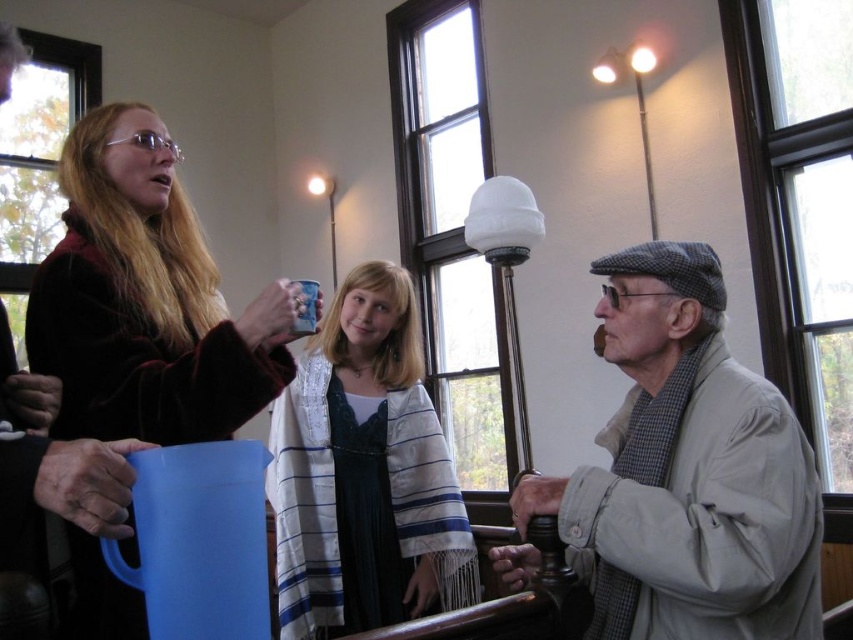
Question: Which point is farther to the camera?

Choices:
 (A) velvet maroon coat at upper left
 (B) white striped shawl at center
 (C) blue matte mug at center

Answer: (B)

Question: Is light beige fabric jacket at lower right wider than white striped shawl at center?

Choices:
 (A) yes
 (B) no

Answer: (B)

Question: Which point is farther from the camera taking this photo?

Choices:
 (A) (694, 611)
 (B) (309, 307)
 (C) (155, 509)
 (D) (270, 492)

Answer: (D)

Question: Is velvet maroon coat at upper left wider than blue plastic mug at upper left?

Choices:
 (A) yes
 (B) no

Answer: (A)

Question: Which object appears farthest from the camera in this image?

Choices:
 (A) light beige fabric jacket at lower right
 (B) blue plastic mug at upper left
 (C) white striped shawl at center

Answer: (C)

Question: Observing the image, what is the correct spatial positioning of light beige fabric jacket at lower right in reference to white striped shawl at center?

Choices:
 (A) below
 (B) above

Answer: (B)